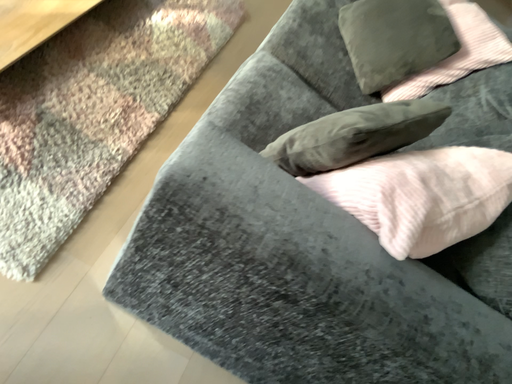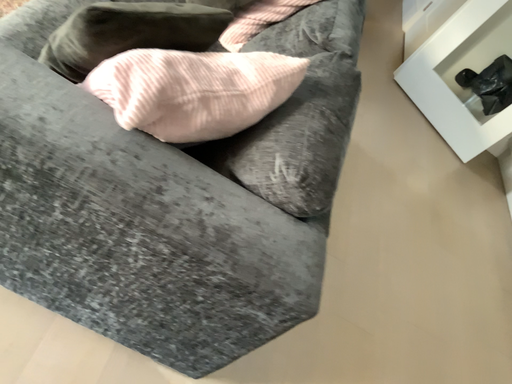
Question: How did the camera likely rotate when shooting the video?

Choices:
 (A) rotated left
 (B) rotated right

Answer: (B)